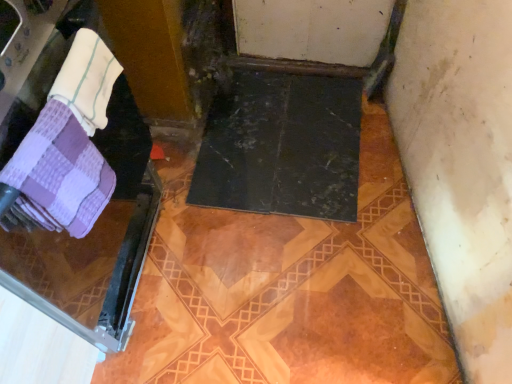
Question: In the image, is purple checkered towel at left on the left side or the right side of white terry cloth towel at upper left, the 2th towel in the bottom-to-top sequence?

Choices:
 (A) left
 (B) right

Answer: (A)

Question: Is purple checkered towel at left taller or shorter than white terry cloth towel at upper left, the 2th towel in the bottom-to-top sequence?

Choices:
 (A) tall
 (B) short

Answer: (A)

Question: Which object is the farthest from the white terry cloth towel at upper left, which is the first towel in top-to-bottom order?

Choices:
 (A) purple checkered towel at left, the first towel in the bottom-to-top sequence
 (B) purple checkered towel at left

Answer: (B)

Question: Based on their relative distances, which object is nearer to the purple checkered towel at left, placed as the 2th towel when sorted from top to bottom?

Choices:
 (A) purple checkered towel at left
 (B) white terry cloth towel at upper left, the 2th towel in the bottom-to-top sequence

Answer: (B)